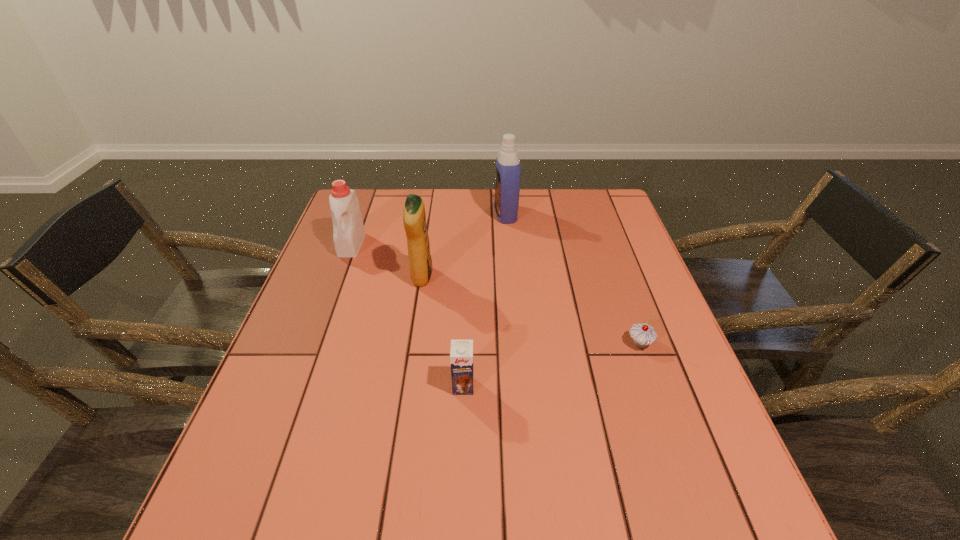
The width and height of the screenshot is (960, 540). I want to click on the farthest object, so click(507, 187).

Locate an element on the screen. The width and height of the screenshot is (960, 540). the second object from right to left is located at coordinates (507, 187).

This screenshot has width=960, height=540. In order to click on the second detergent from right to left in this screenshot , I will do `click(414, 217)`.

What are the coordinates of `the nearest detergent` in the screenshot? It's located at (414, 217).

Locate an element on the screen. the leftmost object is located at coordinates (348, 230).

Identify the location of the second farthest object. (348, 230).

Find the location of a particular element. the third object from right to left is located at coordinates (461, 354).

Where is `chocolate milk`? The width and height of the screenshot is (960, 540). chocolate milk is located at coordinates (461, 354).

Locate an element on the screen. the second nearest object is located at coordinates (643, 334).

Where is `cupcake`? The image size is (960, 540). cupcake is located at coordinates (643, 334).